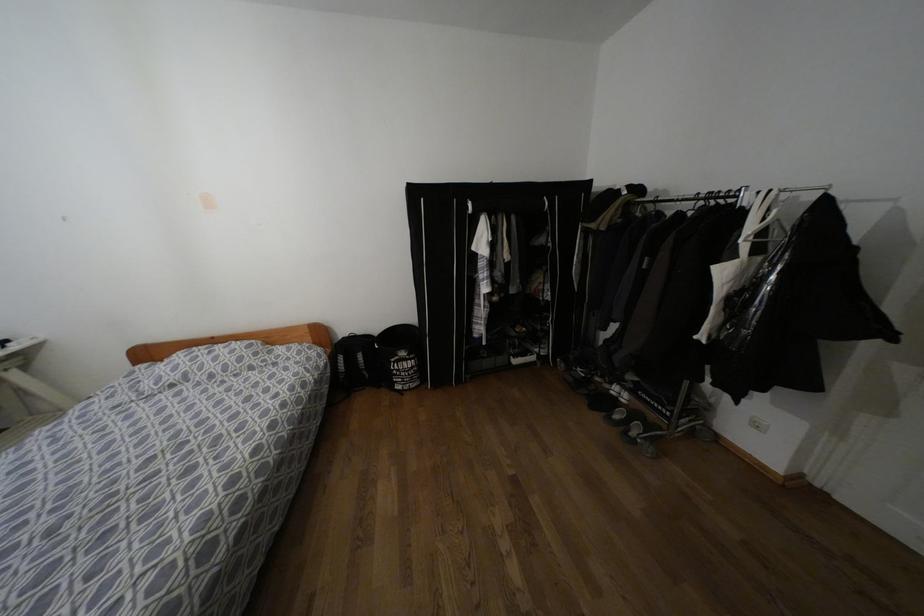
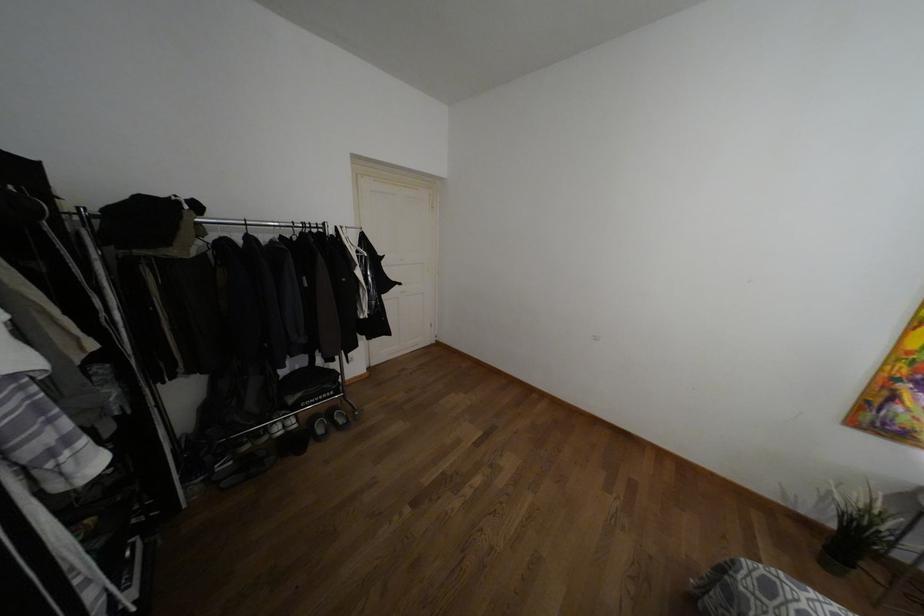
The point at (614, 416) is marked in the first image. Where is the corresponding point in the second image?

(320, 430)